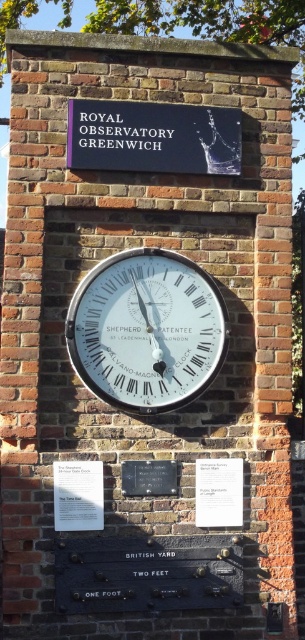
You are standing in front of the Shepherd Gate Clock at the Royal Observatory Greenwich. You notice two points marked on the wall. One is at coordinate point (x=94, y=528) and the other at point (x=197, y=512). Which point is closer to you?

The point at (x=94, y=528) is closer to you because it is in front of the point at (x=197, y=512).

In the scene shown: You are standing in front of the Shepherd Gate Clock at the Royal Observatory Greenwich. You notice two points marked on the wall at coordinates point [124,378] and point [165,129]. Which point is closer to you?

Point [124,378] is closer to the camera than point [165,129], so the point [124,378] is closer to you.

You are standing in front of a historical wall with a clock and a sign. You notice a specific point marked at coordinates (x=146, y=330). What object is located at that point?

The point at coordinates (x=146, y=330) is where the white glossy clock at center is located.